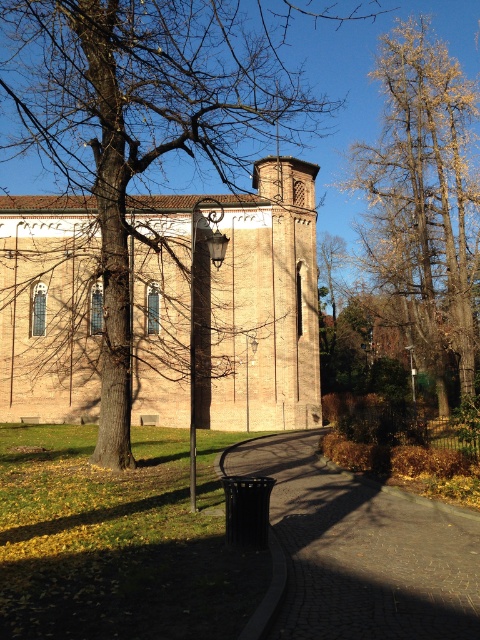
You are a tourist standing at the entrance of the historic brick building and want to take a photo of the brown cobblestone path at lower center. However, you notice the brown textured tree at center might block your view. Based on the scene description, can you determine if the tree is in front of or behind the path?

The brown cobblestone path at lower center is behind the brown textured tree at center, so the tree is in front of the path and would block the view.

You are standing at the entrance of the historic brick building and want to take a photo that includes both point (243,205) and point (446,387). Which point should you focus on first to ensure both are in focus?

You should focus on point (243,205) first because it is closer to the camera, ensuring both points will be within the depth of field.